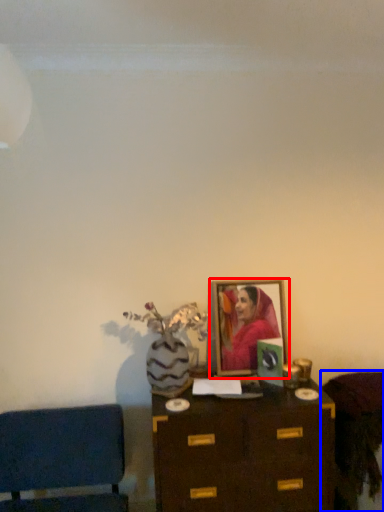
Question: Which object appears closest to the camera in this image, picture frame (highlighted by a red box) or furniture (highlighted by a blue box)?

Choices:
 (A) picture frame
 (B) furniture

Answer: (B)